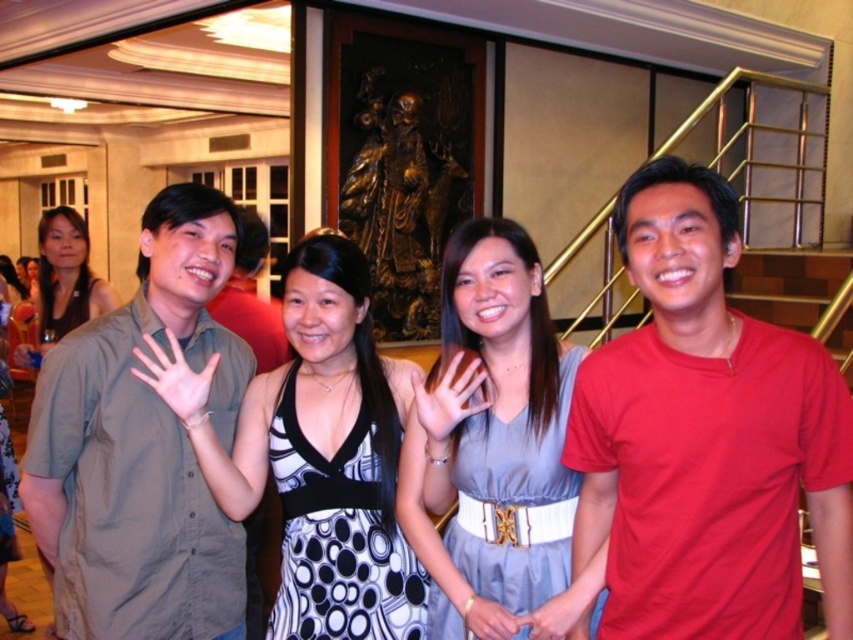
You are taking a photo of two points in the image. The first point is at coordinates point (306,276) and the second is at point (234,300). Which point is closer to the camera?

Point (306,276) is closer to the camera than point (234,300).